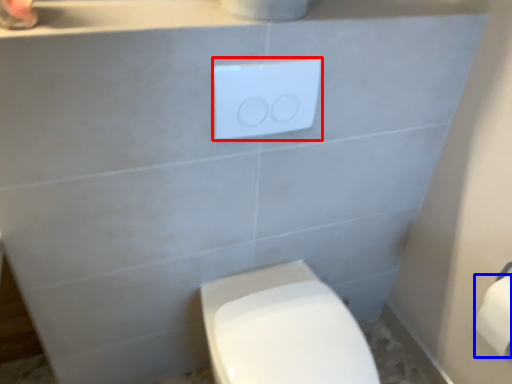
Question: Which object is closer to the camera taking this photo, light switch (highlighted by a red box) or toilet paper (highlighted by a blue box)?

Choices:
 (A) light switch
 (B) toilet paper

Answer: (A)